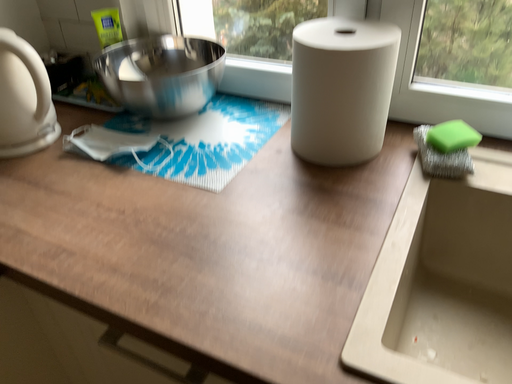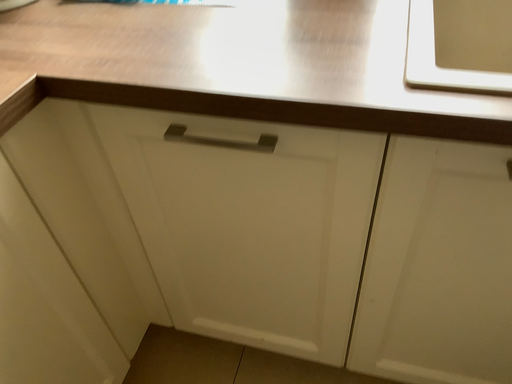
Question: How did the camera likely rotate when shooting the video?

Choices:
 (A) rotated downward
 (B) rotated upward

Answer: (A)